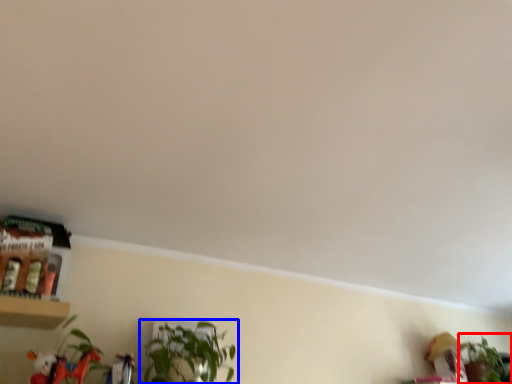
Question: Which object is further to the camera taking this photo, houseplant (highlighted by a red box) or houseplant (highlighted by a blue box)?

Choices:
 (A) houseplant
 (B) houseplant

Answer: (A)